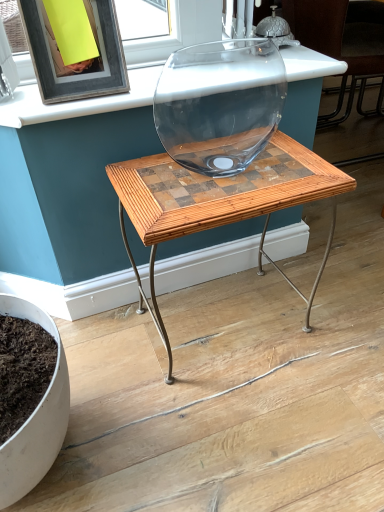
What are the coordinates of `vacant space situated above wooden mosaic table at center (from a real-world perspective)` in the screenshot? It's located at (237, 169).